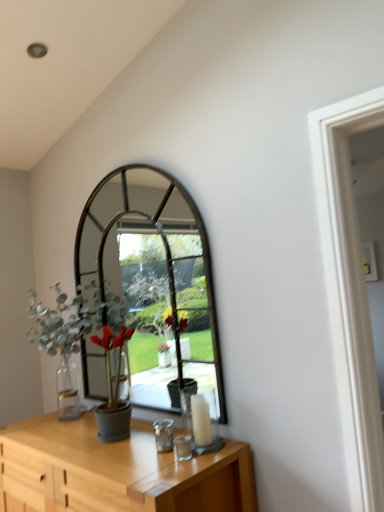
Question: Are light wood table at lower center and white glass candle at center beside each other?

Choices:
 (A) yes
 (B) no

Answer: (B)

Question: Is white glass candle at center completely or partially inside light wood table at lower center?

Choices:
 (A) no
 (B) yes

Answer: (A)

Question: Can you confirm if light wood table at lower center is taller than white glass candle at center?

Choices:
 (A) no
 (B) yes

Answer: (B)

Question: Does light wood table at lower center have a larger size compared to white glass candle at center?

Choices:
 (A) yes
 (B) no

Answer: (A)

Question: Is light wood table at lower center smaller than white glass candle at center?

Choices:
 (A) no
 (B) yes

Answer: (A)

Question: Does light wood table at lower center appear on the right side of white glass candle at center?

Choices:
 (A) no
 (B) yes

Answer: (A)

Question: Is white glass candle at center far from light wood table at lower center?

Choices:
 (A) yes
 (B) no

Answer: (B)

Question: Can you confirm if white glass candle at center is positioned to the left of light wood table at lower center?

Choices:
 (A) no
 (B) yes

Answer: (A)

Question: Is white glass candle at center smaller than light wood table at lower center?

Choices:
 (A) yes
 (B) no

Answer: (A)

Question: Can you confirm if white glass candle at center is taller than light wood table at lower center?

Choices:
 (A) no
 (B) yes

Answer: (A)

Question: From a real-world perspective, is white glass candle at center beneath light wood table at lower center?

Choices:
 (A) no
 (B) yes

Answer: (A)

Question: Is white glass candle at center positioned with its back to light wood table at lower center?

Choices:
 (A) yes
 (B) no

Answer: (B)

Question: Is green matte plant at left to the right of white glass candle at center from the viewer's perspective?

Choices:
 (A) yes
 (B) no

Answer: (B)